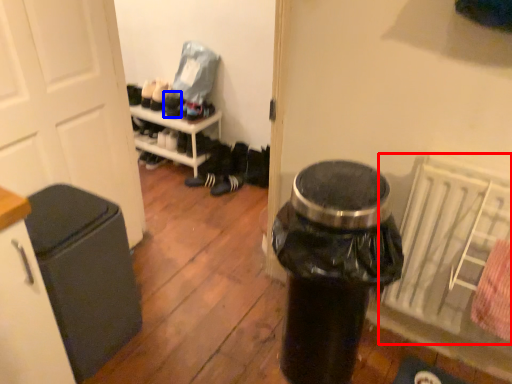
Question: Which point is further to the camera, radiator (highlighted by a red box) or shoe (highlighted by a blue box)?

Choices:
 (A) radiator
 (B) shoe

Answer: (B)